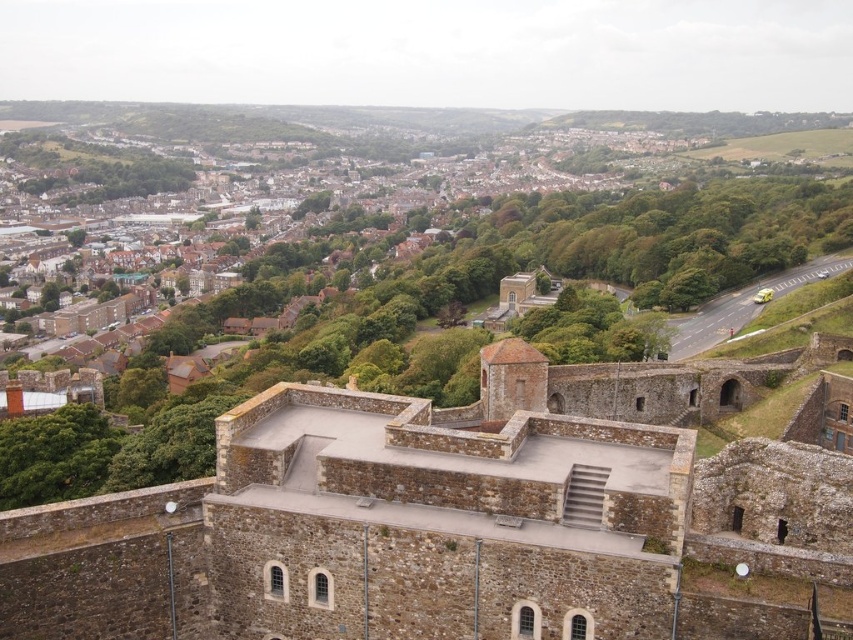
Question: Which point is closer to the camera taking this photo?

Choices:
 (A) (334, 227)
 (B) (735, 369)

Answer: (B)

Question: Does brown stone castle at center have a smaller size compared to brown brick town at upper center?

Choices:
 (A) yes
 (B) no

Answer: (A)

Question: Which point is closer to the camera taking this photo?

Choices:
 (A) (444, 509)
 (B) (669, 221)

Answer: (A)

Question: Does brown stone castle at center come behind brown brick town at upper center?

Choices:
 (A) yes
 (B) no

Answer: (B)

Question: Is brown stone castle at center smaller than brown brick town at upper center?

Choices:
 (A) no
 (B) yes

Answer: (B)